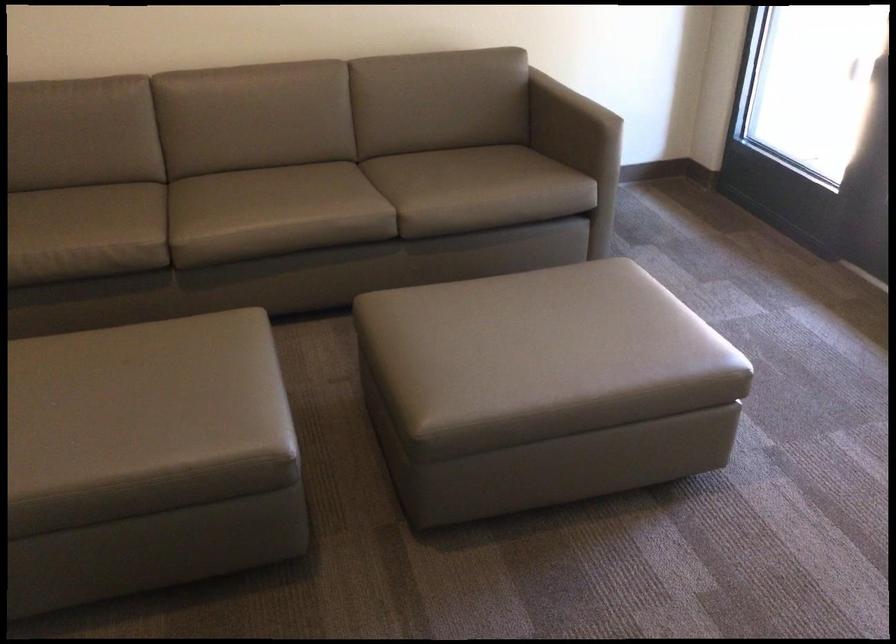
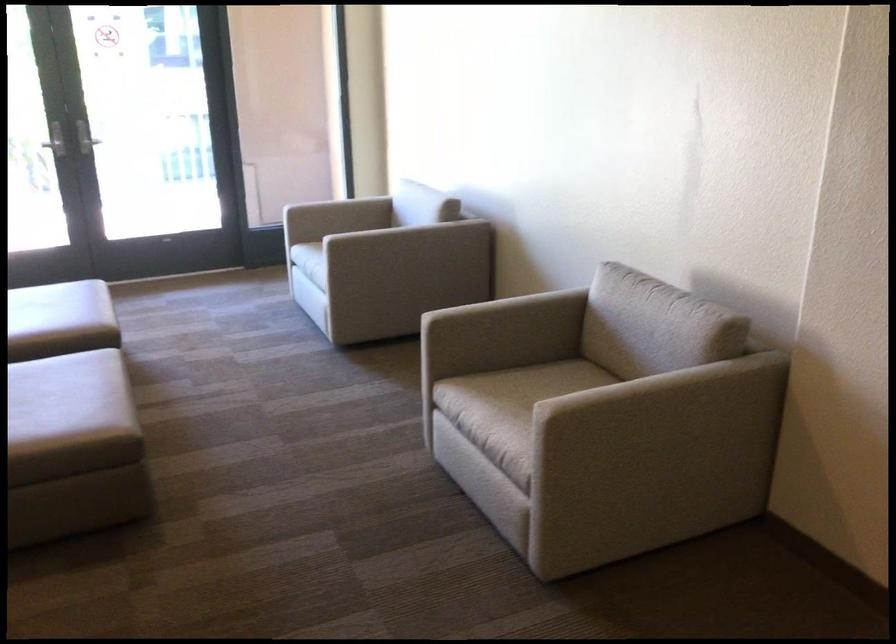
Where in the second image is the point corresponding to (119,446) from the first image?

(65, 384)